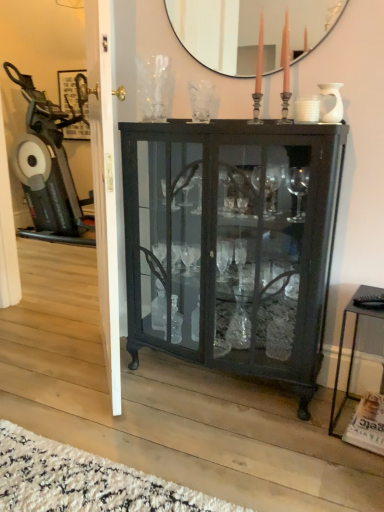
Identify the location of vacant space in matte black cabinet at center (from a real-world perspective). The image size is (384, 512). (201, 377).